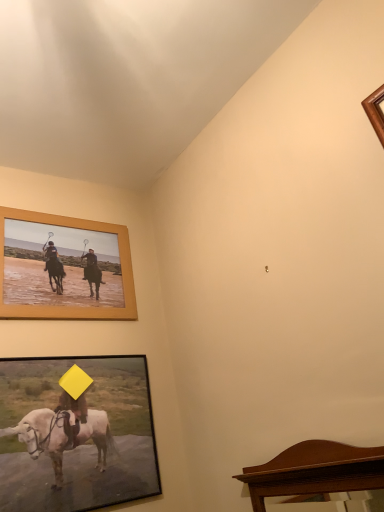
Question: Could wooden-framed picture at lower left, arranged as the second picture frame when viewed from the top, be considered to be inside mahogany wood mirror at lower right?

Choices:
 (A) no
 (B) yes

Answer: (A)

Question: Can you confirm if mahogany wood mirror at lower right is smaller than wooden-framed picture at lower left, arranged as the second picture frame when viewed from the top?

Choices:
 (A) yes
 (B) no

Answer: (B)

Question: From the image's perspective, would you say mahogany wood mirror at lower right is shown under wooden-framed picture at lower left, arranged as the second picture frame when viewed from the top?

Choices:
 (A) yes
 (B) no

Answer: (B)

Question: From a real-world perspective, is mahogany wood mirror at lower right located higher than wooden-framed picture at lower left, the first picture frame in the bottom-to-top sequence?

Choices:
 (A) no
 (B) yes

Answer: (A)

Question: Is mahogany wood mirror at lower right thinner than wooden-framed picture at lower left, the first picture frame in the bottom-to-top sequence?

Choices:
 (A) no
 (B) yes

Answer: (A)

Question: From a real-world perspective, is mahogany wood mirror at lower right physically below wooden-framed picture at lower left, the first picture frame in the bottom-to-top sequence?

Choices:
 (A) no
 (B) yes

Answer: (B)

Question: Is wooden frame at upper left, which appears as the 1th picture frame when viewed from the top, bigger than wooden-framed picture at lower left, arranged as the second picture frame when viewed from the top?

Choices:
 (A) no
 (B) yes

Answer: (A)

Question: From the image's perspective, would you say wooden frame at upper left, which is the second picture frame in bottom-to-top order, is shown under wooden-framed picture at lower left, arranged as the second picture frame when viewed from the top?

Choices:
 (A) no
 (B) yes

Answer: (A)

Question: Considering the relative sizes of wooden frame at upper left, which is the second picture frame in bottom-to-top order, and wooden-framed picture at lower left, arranged as the second picture frame when viewed from the top, in the image provided, is wooden frame at upper left, which is the second picture frame in bottom-to-top order, smaller than wooden-framed picture at lower left, arranged as the second picture frame when viewed from the top,?

Choices:
 (A) yes
 (B) no

Answer: (A)

Question: Is wooden-framed picture at lower left, arranged as the second picture frame when viewed from the top, located within wooden frame at upper left, which appears as the 1th picture frame when viewed from the top?

Choices:
 (A) no
 (B) yes

Answer: (A)

Question: From a real-world perspective, does wooden frame at upper left, which is the second picture frame in bottom-to-top order, sit lower than wooden-framed picture at lower left, the first picture frame in the bottom-to-top sequence?

Choices:
 (A) no
 (B) yes

Answer: (A)

Question: Is wooden frame at upper left, which is the second picture frame in bottom-to-top order, aimed at wooden-framed picture at lower left, arranged as the second picture frame when viewed from the top?

Choices:
 (A) yes
 (B) no

Answer: (B)

Question: From a real-world perspective, is wooden-framed picture at lower left, the first picture frame in the bottom-to-top sequence, beneath mahogany wood mirror at lower right?

Choices:
 (A) no
 (B) yes

Answer: (A)